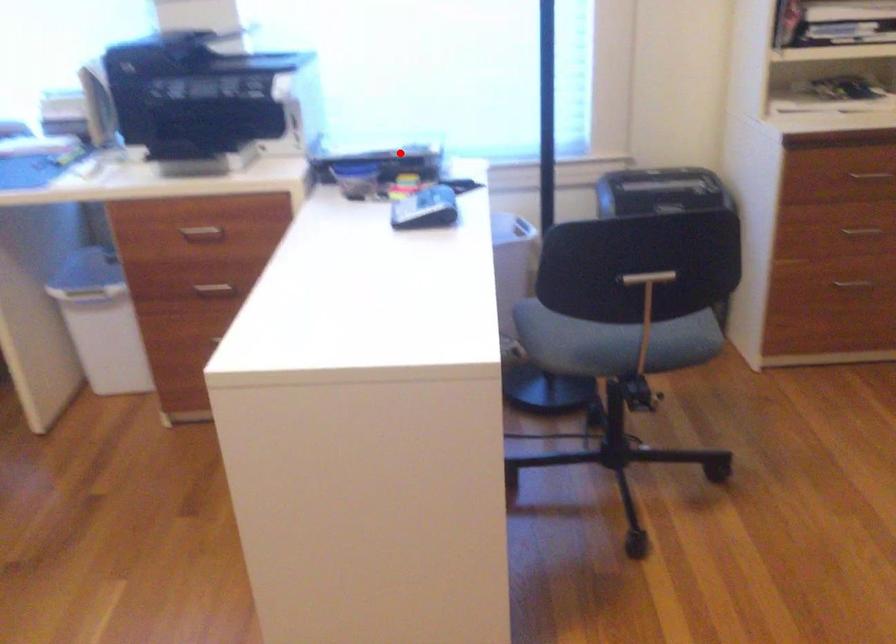
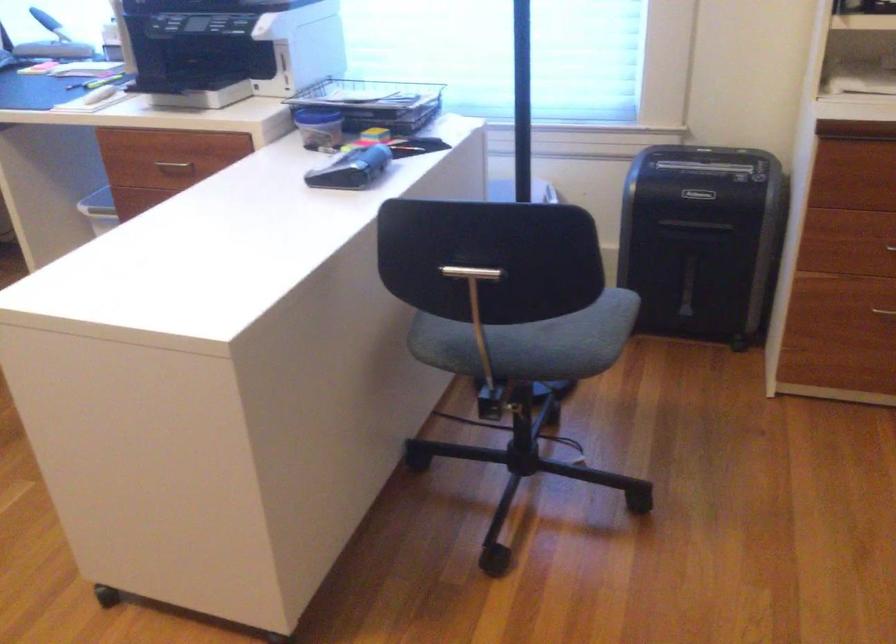
Locate, in the second image, the point that corresponds to the highlighted location in the first image.

(374, 102)